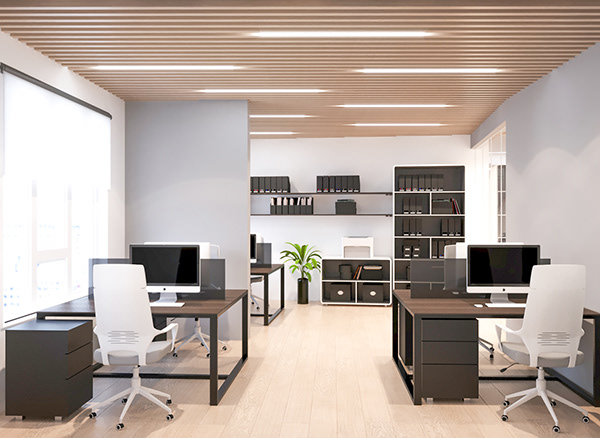
Find the location of a particular element. floor is located at coordinates (323, 386).